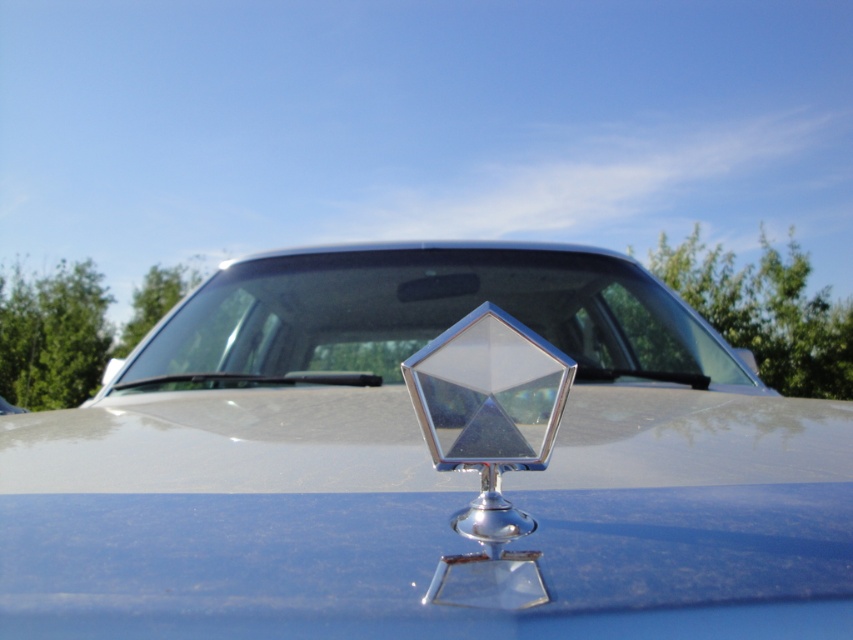
You are a car designer checking the hood ornament placement. You need to ensure that the shiny chrome emblem at center does not extend beyond the transparent glass windshield at center. Can you confirm if the emblem is within the windshield boundaries?

The shiny chrome emblem at center might be wider than transparent glass windshield at center, so there is a possibility that it extends beyond the windshield boundaries and needs adjustment.

You are a car enthusiast examining the hood ornament of a vintage car. You notice a point at coordinates [428,465]. What object is located at this point?

The shiny chrome emblem at center is located at point [428,465].

Consider the image. You are standing in front of a vintage car and want to take a photo of the hood ornament. The hood ornament is located at point (503, 256). If the camera is 8.86 feet away from the point, is the camera positioned far enough to capture the entire ornament in the frame?

The distance between the camera and point (503, 256) is 8.86 feet. To determine if the camera is far enough to capture the entire hood ornament, consider the field of view of the camera lens. However, since the hood ornament is centrally positioned on the car and the camera is positioned at this distance, it is likely that the camera is far enough to capture the entire ornament in the frame.